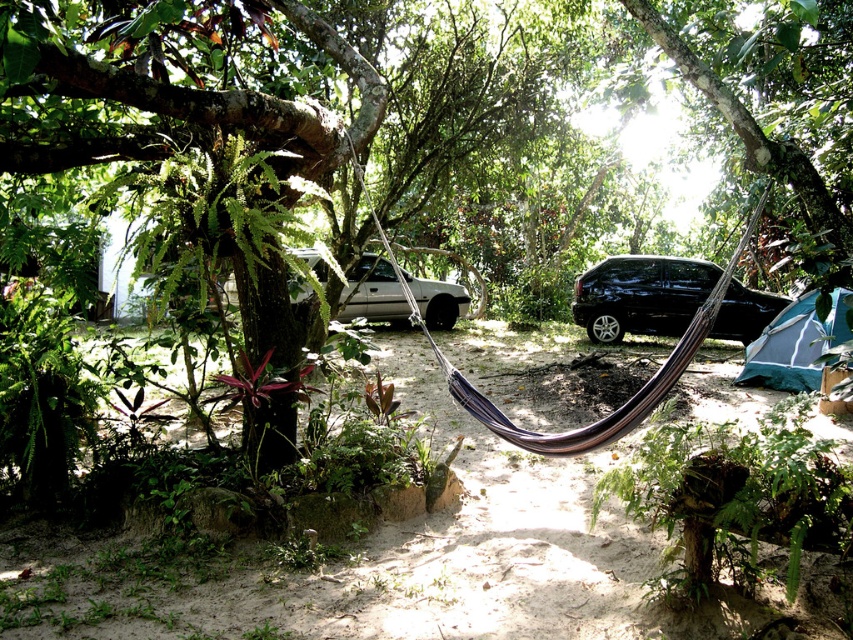
The image size is (853, 640). I want to click on green rough bark tree at upper left, so click(175, 144).

Between point (204, 324) and point (340, 310), which one is positioned in front?

Positioned in front is point (204, 324).

The image size is (853, 640). In order to click on green rough bark tree at upper left in this screenshot , I will do `click(175, 144)`.

Based on the photo, can you confirm if green rough bark tree at upper left is wider than green leafy tree at upper center?

Indeed, green rough bark tree at upper left has a greater width compared to green leafy tree at upper center.

Is green rough bark tree at upper left shorter than green leafy tree at upper center?

In fact, green rough bark tree at upper left may be taller than green leafy tree at upper center.

Find the location of a particular element. The width and height of the screenshot is (853, 640). green rough bark tree at upper left is located at coordinates (175, 144).

Where is `green rough bark tree at upper left`? This screenshot has width=853, height=640. green rough bark tree at upper left is located at coordinates (175, 144).

Is green rough bark tree at upper left positioned before black glossy car at center?

Yes.

Which is behind, point (19, 266) or point (669, 300)?

The point (669, 300) is more distant.

You are a GUI agent. You are given a task and a screenshot of the screen. Output one action in this format:
    pyautogui.click(x=<x>, y=<y>)
    Task: Click on the green rough bark tree at upper left
    The height and width of the screenshot is (640, 853).
    Given the screenshot: What is the action you would take?
    pyautogui.click(x=175, y=144)